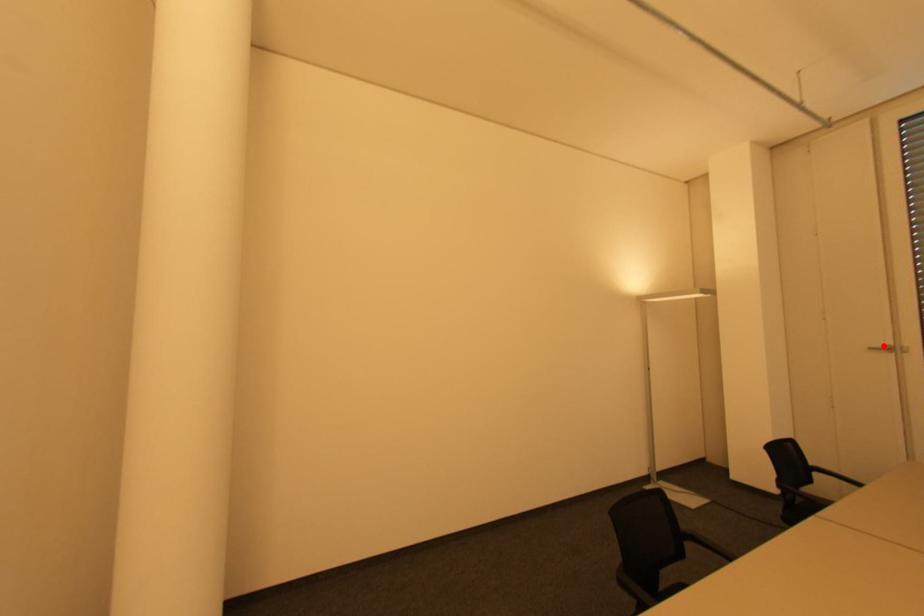
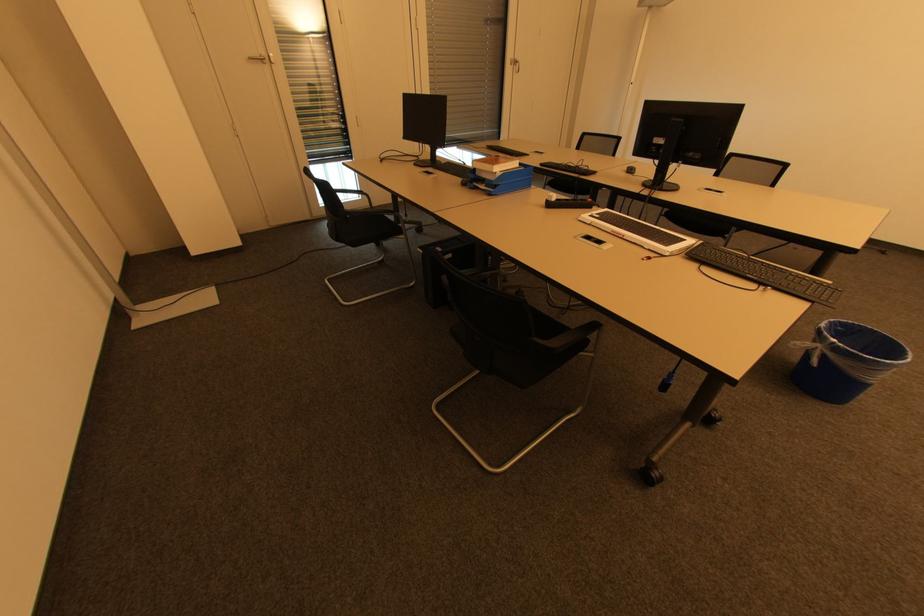
The point at the highlighted location is marked in the first image. Where is the corresponding point in the second image?

(258, 55)